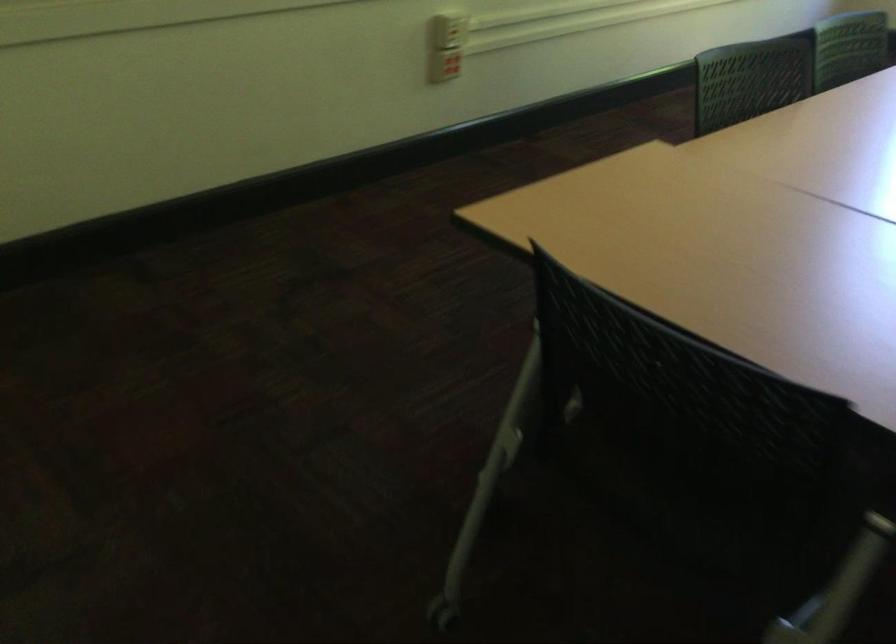
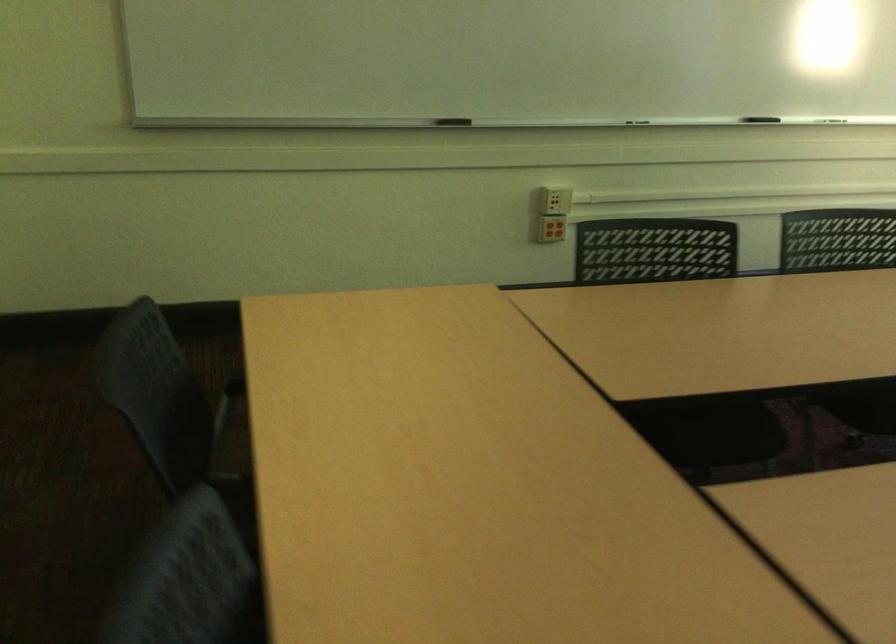
The point at [410,67] is marked in the first image. Where is the corresponding point in the second image?

(550, 230)